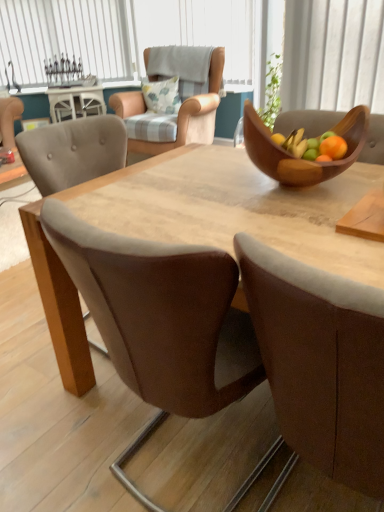
Question: Does white glossy cabinet at upper left appear on the left side of fluffy white pillow at upper center?

Choices:
 (A) no
 (B) yes

Answer: (B)

Question: Is white glossy cabinet at upper left facing towards fluffy white pillow at upper center?

Choices:
 (A) no
 (B) yes

Answer: (A)

Question: Considering the relative sizes of white glossy cabinet at upper left and fluffy white pillow at upper center in the image provided, is white glossy cabinet at upper left shorter than fluffy white pillow at upper center?

Choices:
 (A) no
 (B) yes

Answer: (B)

Question: Considering the relative sizes of white glossy cabinet at upper left and fluffy white pillow at upper center in the image provided, is white glossy cabinet at upper left wider than fluffy white pillow at upper center?

Choices:
 (A) yes
 (B) no

Answer: (A)

Question: Considering the relative sizes of white glossy cabinet at upper left and fluffy white pillow at upper center in the image provided, is white glossy cabinet at upper left bigger than fluffy white pillow at upper center?

Choices:
 (A) no
 (B) yes

Answer: (B)

Question: Does white glossy cabinet at upper left appear on the right side of fluffy white pillow at upper center?

Choices:
 (A) no
 (B) yes

Answer: (A)

Question: From the image's perspective, is wooden bowl at center located above fluffy white pillow at upper center?

Choices:
 (A) yes
 (B) no

Answer: (B)

Question: From a real-world perspective, is wooden bowl at center located higher than fluffy white pillow at upper center?

Choices:
 (A) no
 (B) yes

Answer: (B)

Question: Is wooden bowl at center not close to fluffy white pillow at upper center?

Choices:
 (A) yes
 (B) no

Answer: (A)

Question: From a real-world perspective, is wooden bowl at center physically below fluffy white pillow at upper center?

Choices:
 (A) no
 (B) yes

Answer: (A)

Question: Could you tell me if wooden bowl at center is facing fluffy white pillow at upper center?

Choices:
 (A) no
 (B) yes

Answer: (A)

Question: Is wooden bowl at center bigger than fluffy white pillow at upper center?

Choices:
 (A) no
 (B) yes

Answer: (B)

Question: Does brown leather chair at center, the second chair positioned from the back, contain white vertical blinds at upper left?

Choices:
 (A) no
 (B) yes

Answer: (A)